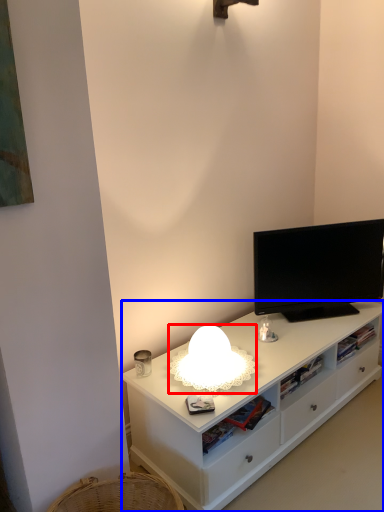
Question: Which object appears closest to the camera in this image, lamp (highlighted by a red box) or cabinetry (highlighted by a blue box)?

Choices:
 (A) lamp
 (B) cabinetry

Answer: (B)